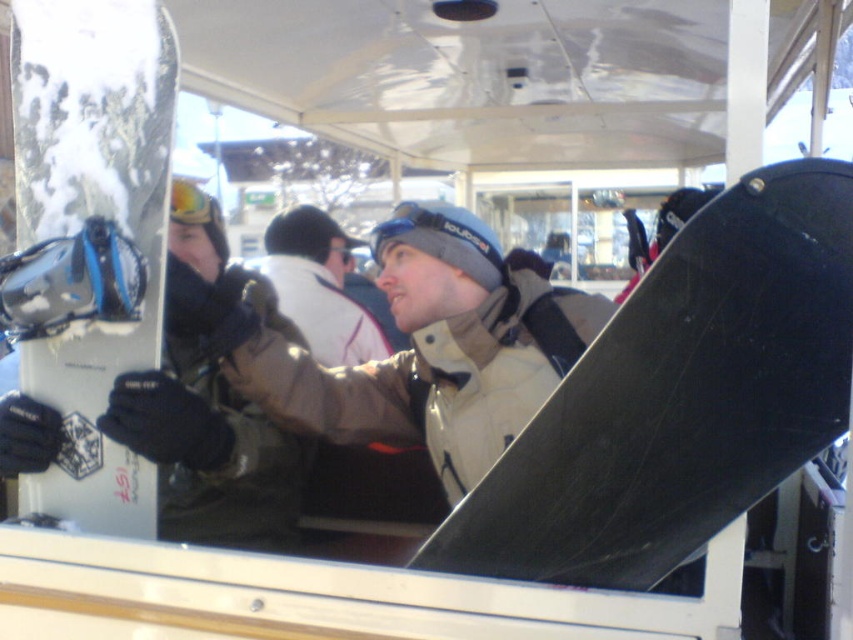
You are planning to pack your gear into a small compartment. The white matte snowboard at left and the white fleece jacket at center are both in your bag. Which item takes up less space?

The white matte snowboard at left is smaller than the white fleece jacket at center, so it takes up less space.

You are planning to carry both the white matte snowboard at left and the matte black snowboard at left onto a narrow ski lift. Given their sizes, which one should you pick up first to ensure they both fit comfortably?

The white matte snowboard at left is smaller than the matte black snowboard at left, so you should pick up the larger matte black snowboard at left first to ensure there is enough space for both.

You are a photographer trying to capture a photo of the matte beige jacket at center and the matte black snowboard at left. To ensure both are fully visible in the frame, which object should you focus on first considering their heights?

The matte beige jacket at center is shorter than the matte black snowboard at left, so you should focus on the matte beige jacket at center first to ensure it is fully in the frame.